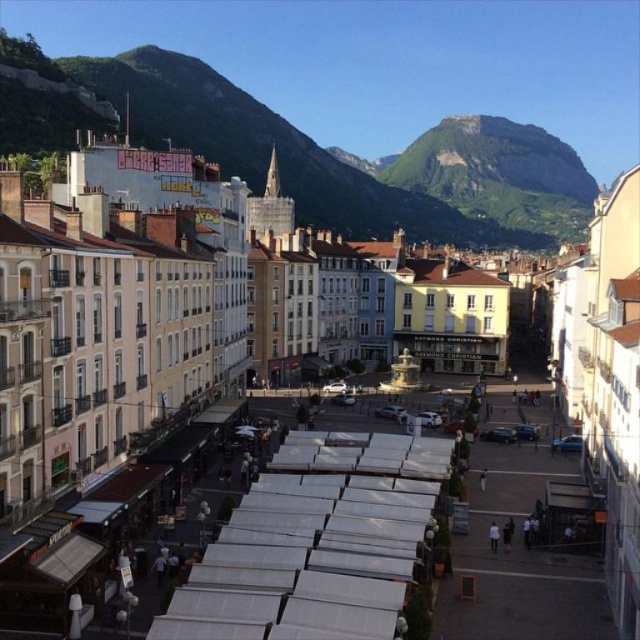
Between rocky brown mountain at upper center and green rock mountain at upper center, which one has less height?

Standing shorter between the two is green rock mountain at upper center.

Can you confirm if rocky brown mountain at upper center is thinner than green rock mountain at upper center?

Incorrect, rocky brown mountain at upper center's width is not less than green rock mountain at upper center's.

What do you see at coordinates (346, 161) in the screenshot? This screenshot has width=640, height=640. I see `rocky brown mountain at upper center` at bounding box center [346, 161].

Identify the location of rocky brown mountain at upper center. (346, 161).